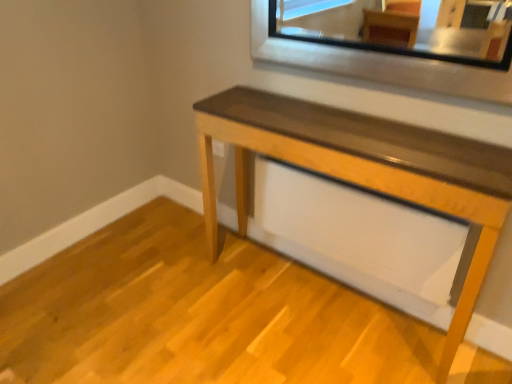
The width and height of the screenshot is (512, 384). What are the coordinates of `wooden table at lower right` in the screenshot? It's located at (362, 170).

This screenshot has width=512, height=384. Describe the element at coordinates (362, 170) in the screenshot. I see `wooden table at lower right` at that location.

Identify the location of wooden table at lower right. (362, 170).